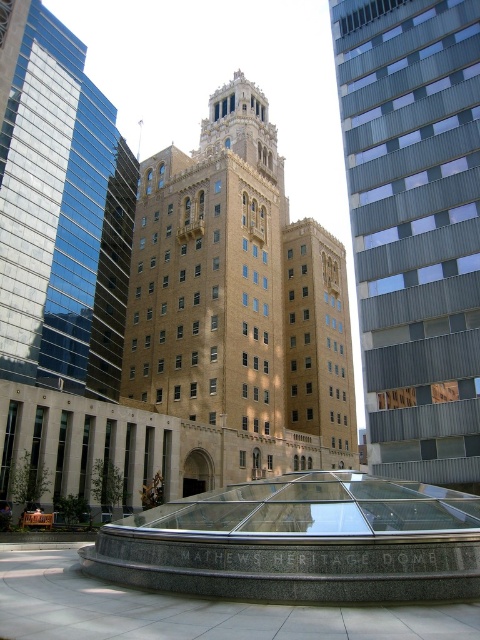
Question: Which is farther from the granite dome at center?

Choices:
 (A) metallic silver bell tower at center
 (B) brown brick bell tower at center
 (C) brick tower at center

Answer: (B)

Question: Can you confirm if metallic silver bell tower at center is thinner than brick tower at center?

Choices:
 (A) no
 (B) yes

Answer: (A)

Question: Is metallic silver bell tower at center closer to the viewer compared to brick tower at center?

Choices:
 (A) no
 (B) yes

Answer: (B)

Question: Among these points, which one is farthest from the camera?

Choices:
 (A) (200, 202)
 (B) (133, 204)
 (C) (360, 170)
 (D) (448, 506)

Answer: (B)

Question: Is brown brick bell tower at center to the left of metallic silver bell tower at center from the viewer's perspective?

Choices:
 (A) yes
 (B) no

Answer: (A)

Question: Which of the following is the farthest from the observer?

Choices:
 (A) brick tower at center
 (B) granite dome at center

Answer: (A)